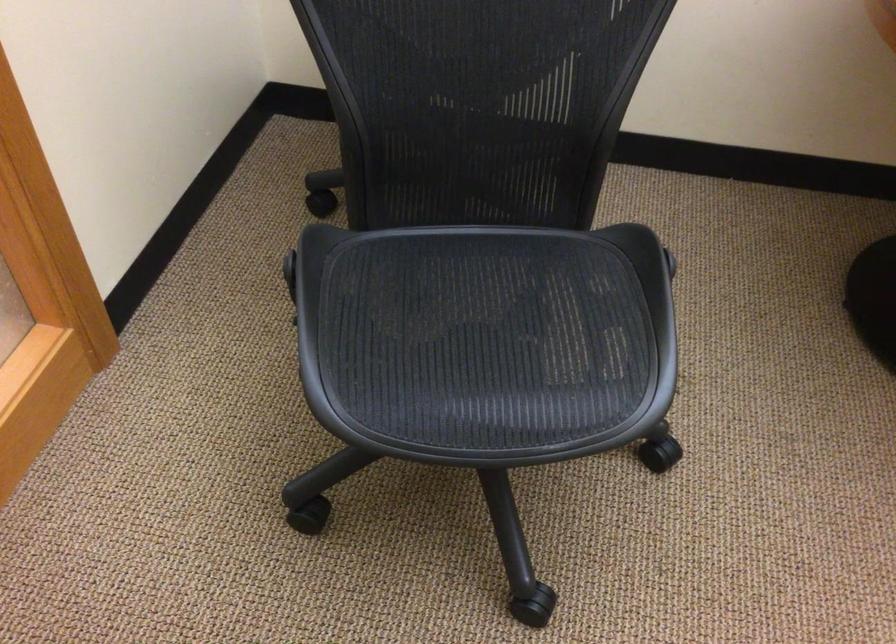
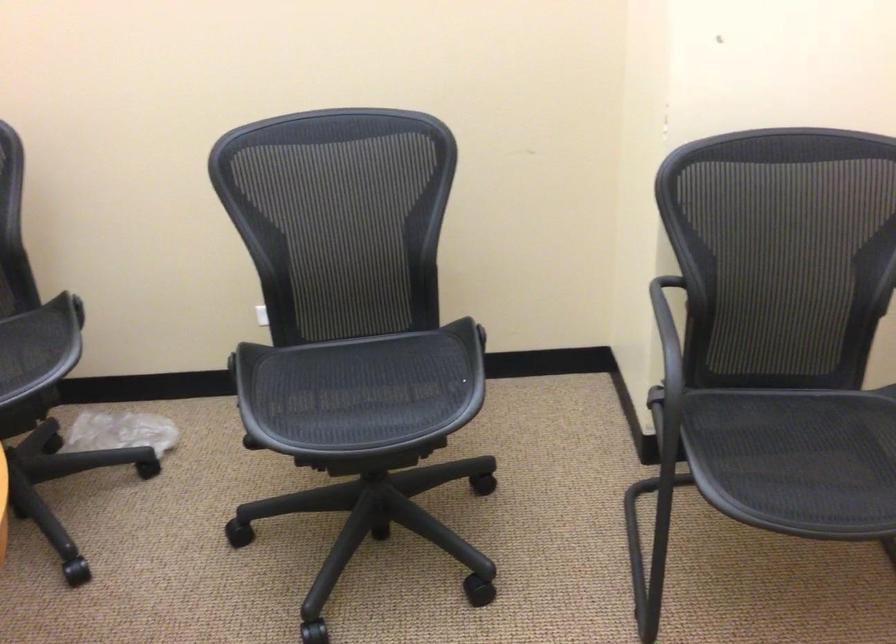
How did the camera likely rotate?

The camera's rotation is toward right-down.